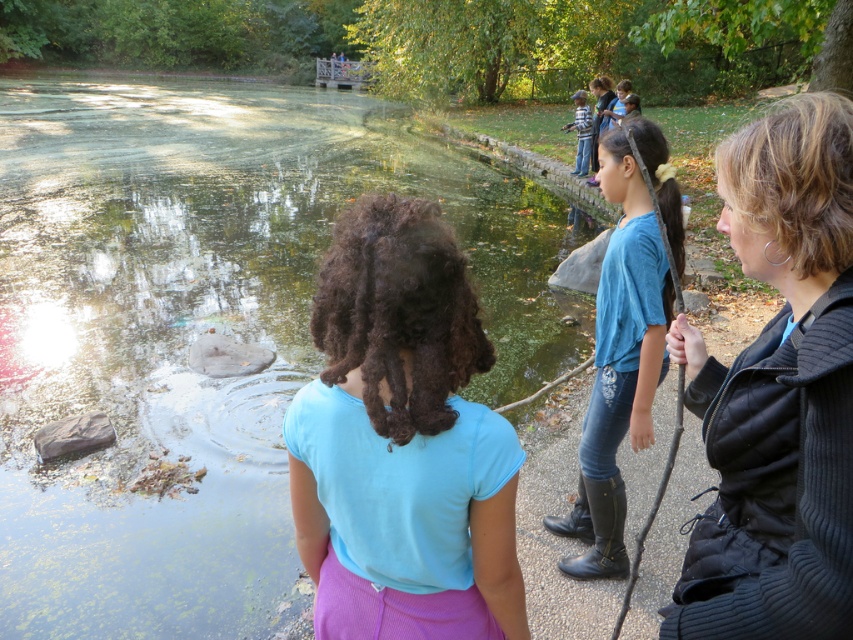
I want to click on green algae-covered water at center, so [207, 332].

Is green algae-covered water at center to the left of blue denim jeans at upper right from the viewer's perspective?

Yes, green algae-covered water at center is to the left of blue denim jeans at upper right.

Is point (123, 467) closer to viewer compared to point (625, 305)?

No, it is behind (625, 305).

I want to click on green algae-covered water at center, so click(207, 332).

From the picture: Who is positioned more to the left, green algae-covered water at center or blue denim jeans at upper center?

green algae-covered water at center is more to the left.

Describe the element at coordinates (207, 332) in the screenshot. This screenshot has height=640, width=853. I see `green algae-covered water at center` at that location.

Between point (263, 262) and point (589, 115), which one is positioned behind?

The point (589, 115) is behind.

This screenshot has width=853, height=640. What are the coordinates of `green algae-covered water at center` in the screenshot? It's located at (207, 332).

Is point (445, 314) positioned before point (625, 141)?

Yes, it is in front of point (625, 141).

Is blue fabric shirt at center further to camera compared to blue denim jeans at upper right?

No, blue fabric shirt at center is in front of blue denim jeans at upper right.

Describe the element at coordinates (402, 440) in the screenshot. I see `blue fabric shirt at center` at that location.

Locate an element on the screen. This screenshot has height=640, width=853. blue fabric shirt at center is located at coordinates (402, 440).